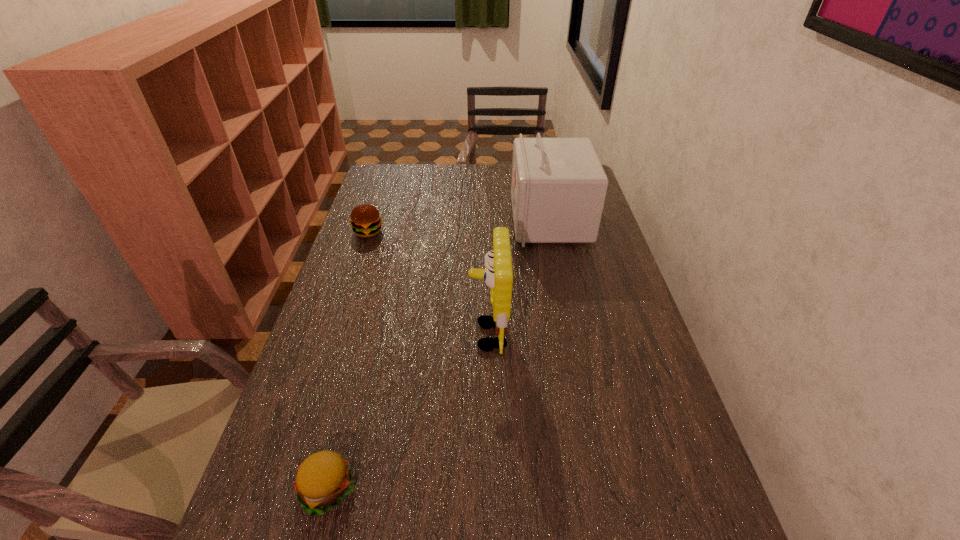
Choose which object is the nearest neighbor to the nearer hamburger. Please provide its 2D coordinates. Your answer should be formatted as a tuple, i.e. [(x, y)], where the tuple contains the x and y coordinates of a point satisfying the conditions above.

[(498, 276)]

Where is `object identified as the second closest to the first-aid kit`? object identified as the second closest to the first-aid kit is located at coordinates [x=366, y=221].

Identify the location of blank space that satisfies the following two spatial constraints: 1. on the front-facing side of the rightmost object; 2. on the front side of the shortest object. (608, 489).